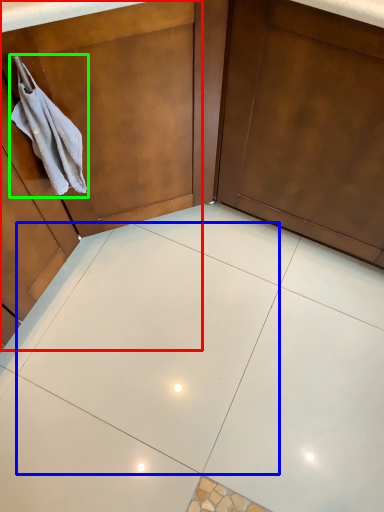
Question: Which object is positioned farthest from dresser (highlighted by a red box)? Select from ceramic tile (highlighted by a blue box) and hand towel (highlighted by a green box).

Choices:
 (A) ceramic tile
 (B) hand towel

Answer: (A)